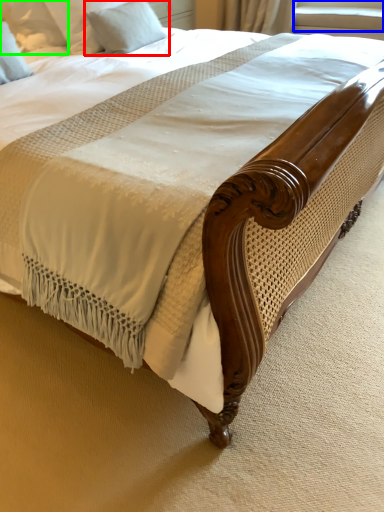
Question: Estimate the real-world distances between objects in this image. Which object is closer to pillow (highlighted by a red box), window screen (highlighted by a blue box) or pillow (highlighted by a green box)?

Choices:
 (A) window screen
 (B) pillow

Answer: (B)